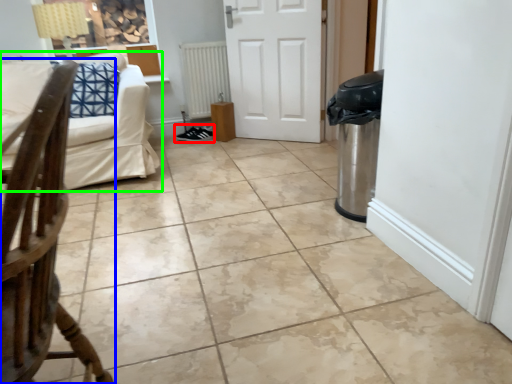
Question: Estimate the real-world distances between objects in this image. Which object is closer to footwear (highlighted by a red box), chair (highlighted by a blue box) or studio couch (highlighted by a green box)?

Choices:
 (A) chair
 (B) studio couch

Answer: (B)